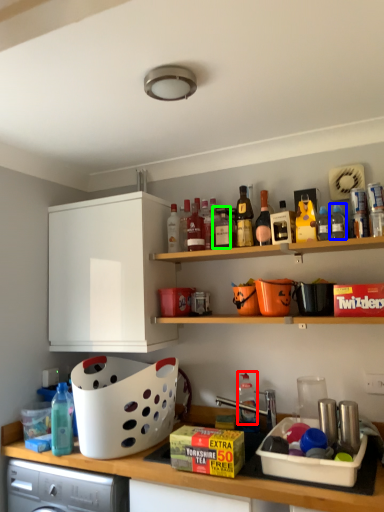
Question: Which object is the closest to the bottle (highlighted by a red box)? Choose among these: bottle (highlighted by a blue box) or bottle (highlighted by a green box).

Choices:
 (A) bottle
 (B) bottle

Answer: (B)